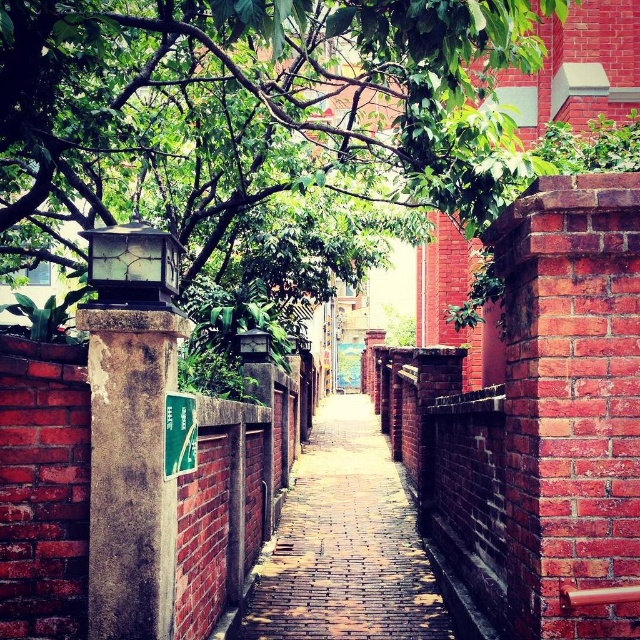
You are standing at the entrance of the alleyway and want to take a photo of the green leafy tree at upper left and the brick paved walkway at center. Which object should you position to your left side to capture both in the frame?

The green leafy tree at upper left is to the left of the brick paved walkway at center, so you should position the brick paved walkway at center to your right side to have the green leafy tree at upper left on the left side of the frame.

Consider the image. You are standing at the entrance of the alleyway and see two points marked on the ground. The first point is at coordinates point (173,61) and the second is at point (326,440). Which point is closer to you as you face the alley?

Point (173,61) is in front of point (326,440), so the first point is closer to you.

You are a delivery person trying to navigate through the alley. You need to avoid hitting the green leafy tree at upper left while driving over the brick paved walkway at center. Which direction should you adjust your path to avoid the tree?

The green leafy tree at upper left is above the brick paved walkway at center, so you should lower your path or move downward to avoid hitting the tree.